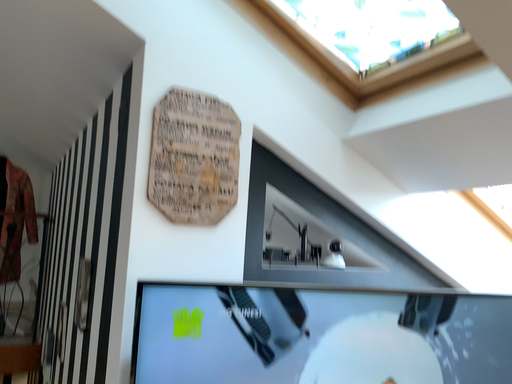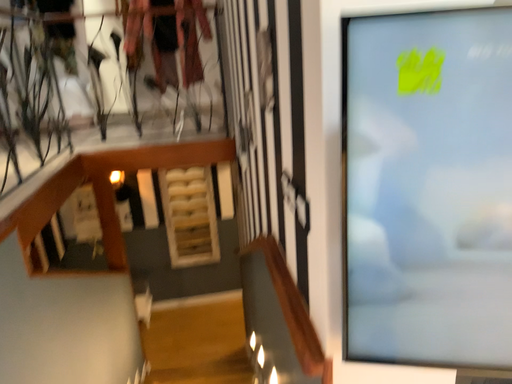
Question: How did the camera likely rotate when shooting the video?

Choices:
 (A) rotated right
 (B) rotated left

Answer: (B)